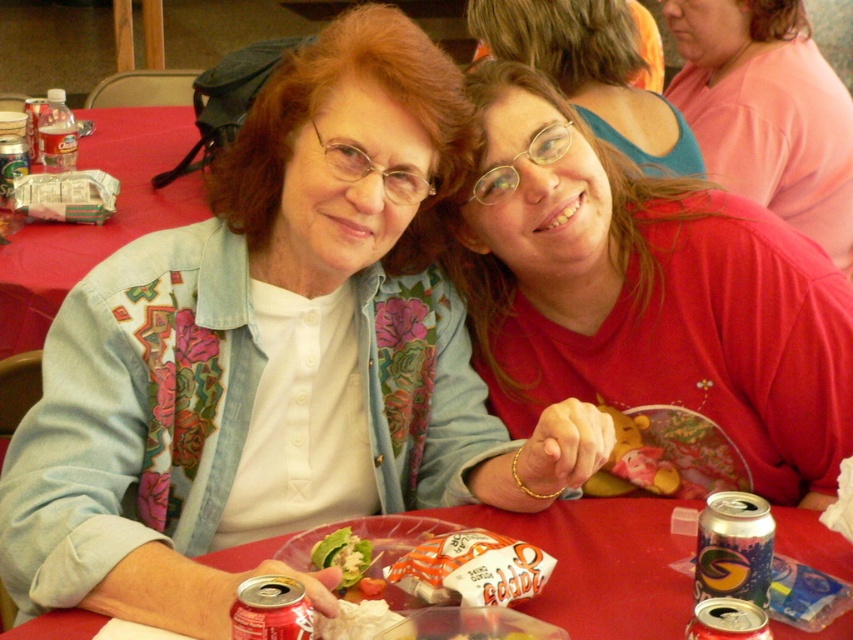
Question: Can you confirm if pink matte shirt at upper right is positioned to the left of red plastic table at lower center?

Choices:
 (A) no
 (B) yes

Answer: (A)

Question: Which object is the closest to the metallic red can at lower left?

Choices:
 (A) green leafy salad at center
 (B) shiny metallic soda can at lower right

Answer: (A)

Question: Is the position of red plastic table at lower center less distant than that of matte red shirt at center?

Choices:
 (A) no
 (B) yes

Answer: (B)

Question: Among these objects, which one is nearest to the camera?

Choices:
 (A) red plastic table at lower center
 (B) red matte shirt at upper right
 (C) metallic red can at lower left
 (D) green leafy salad at center

Answer: (C)

Question: Which point is closer to the camera?

Choices:
 (A) (293, 596)
 (B) (631, 502)
 (C) (811, 49)

Answer: (A)

Question: Observing the image, what is the correct spatial positioning of matte red shirt at center in reference to green leafy salad at center?

Choices:
 (A) left
 (B) right

Answer: (B)